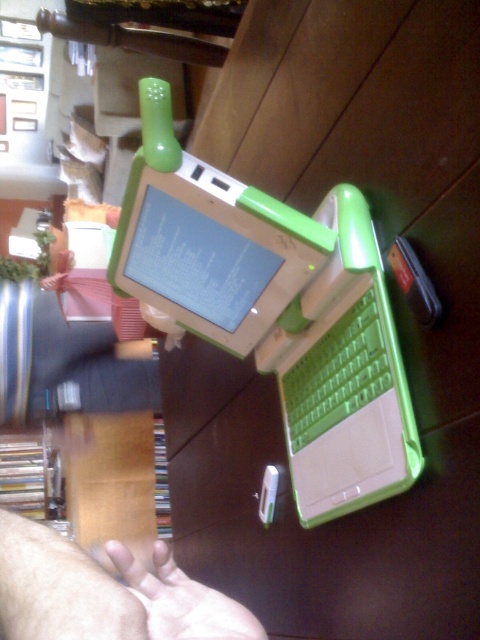
Can you confirm if green plastic laptop at center is bigger than skinny white hand at lower left?

→ Correct, green plastic laptop at center is larger in size than skinny white hand at lower left.

Is point (224, 298) behind point (189, 634)?

Yes.

Which is behind, point (171, 236) or point (229, 618)?

Point (171, 236)

This screenshot has width=480, height=640. Identify the location of green plastic laptop at center. (213, 252).